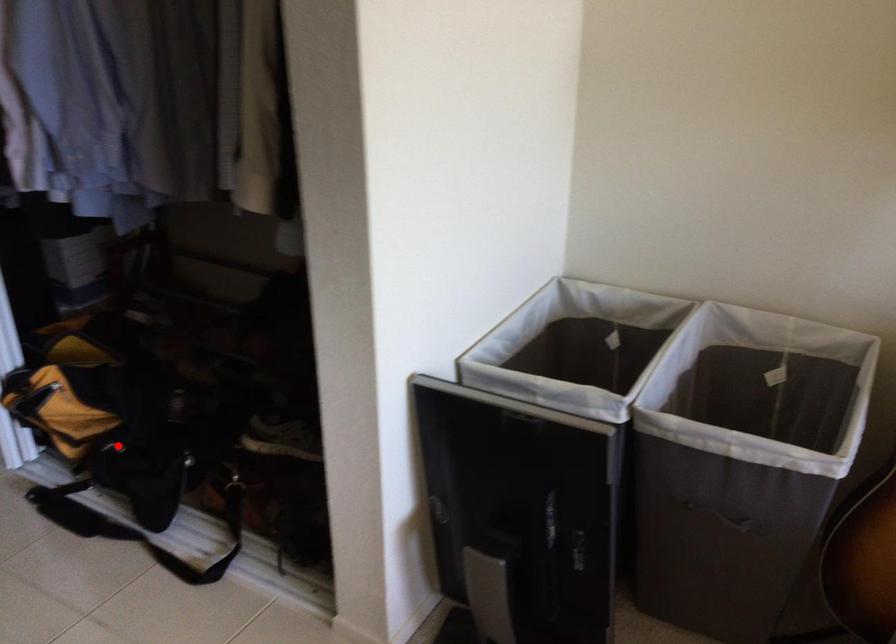
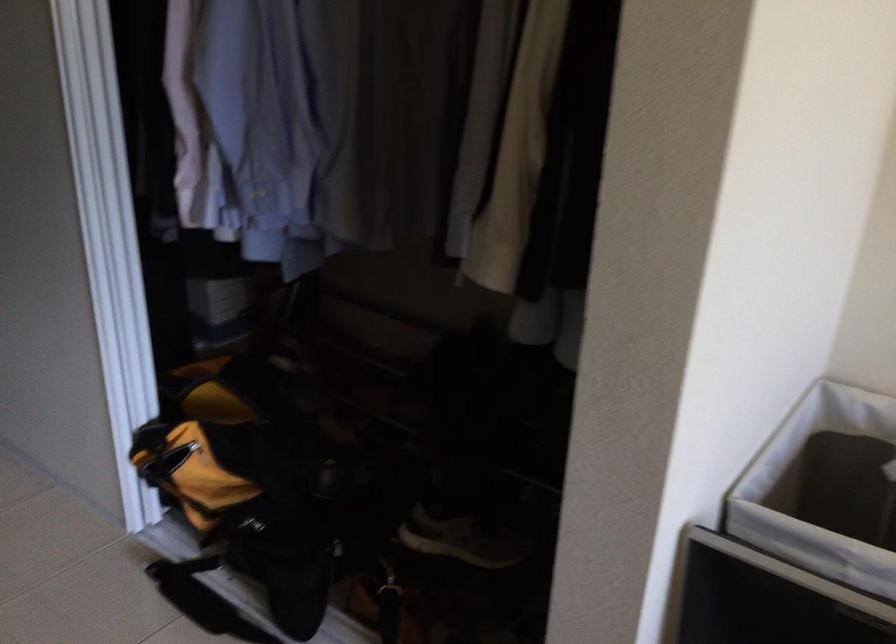
Question: I am providing you with two images of the same scene from different viewpoints. A red point is shown in image1. For the corresponding object point in image2, is it positioned nearer or farther from the camera?

Choices:
 (A) Nearer
 (B) Farther

Answer: (A)